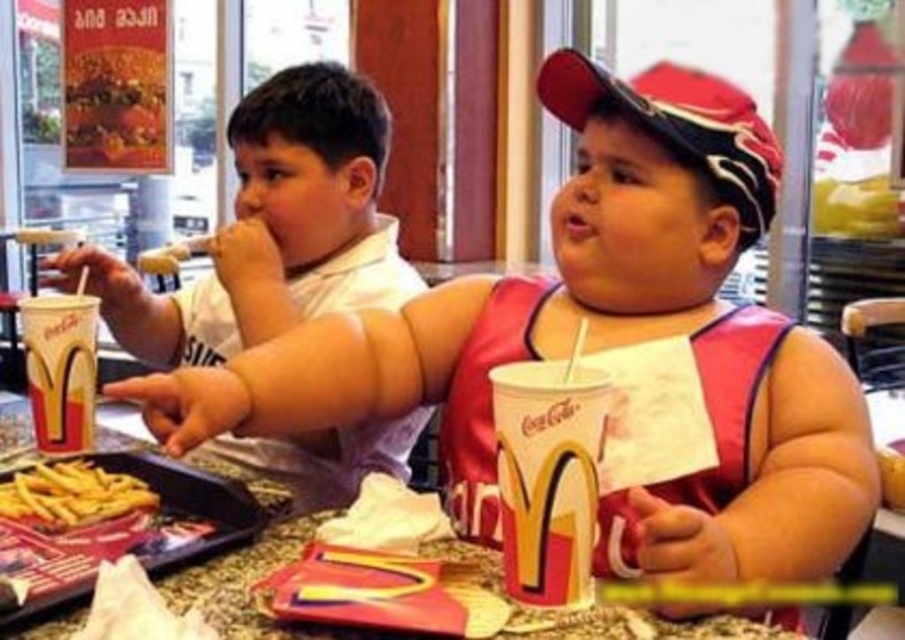
Does matte paper cup at lower left have a lesser height compared to yellow crispy french fries at lower left?

No, matte paper cup at lower left is not shorter than yellow crispy french fries at lower left.

Can you confirm if matte paper cup at lower left is bigger than yellow crispy french fries at lower left?

Yes.

Is point (83, 435) positioned in front of point (13, 476)?

No, it is behind (13, 476).

Locate an element on the screen. The width and height of the screenshot is (905, 640). matte paper cup at lower left is located at coordinates [60, 369].

Does yellow matte french fries at lower left have a greater width compared to yellow crispy french fries at lower left?

Yes, yellow matte french fries at lower left is wider than yellow crispy french fries at lower left.

Does yellow matte french fries at lower left appear on the right side of yellow crispy french fries at lower left?

Indeed, yellow matte french fries at lower left is positioned on the right side of yellow crispy french fries at lower left.

Is point (2, 618) closer to viewer compared to point (55, 467)?

Yes.

Locate an element on the screen. The width and height of the screenshot is (905, 640). yellow matte french fries at lower left is located at coordinates (131, 532).

How much distance is there between matte paper cup at center and yellow crispy french fries at lower left?

The distance of matte paper cup at center from yellow crispy french fries at lower left is 20.16 inches.

Consider the image. Who is more distant from viewer, (560, 420) or (22, 506)?

Positioned behind is point (22, 506).

I want to click on matte paper cup at center, so click(548, 476).